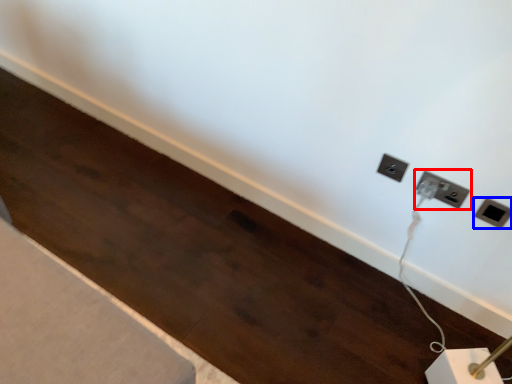
Question: Which object is closer to the camera taking this photo, power plugs and sockets (highlighted by a red box) or power plugs and sockets (highlighted by a blue box)?

Choices:
 (A) power plugs and sockets
 (B) power plugs and sockets

Answer: (B)